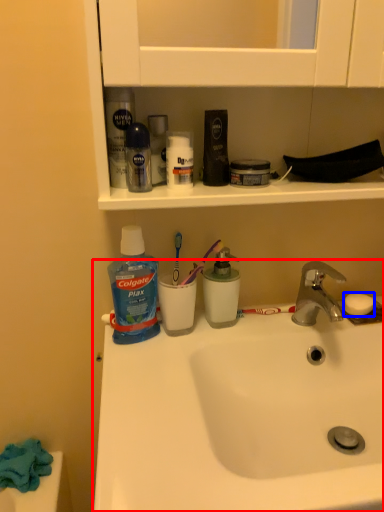
Question: Which object is closer to the camera taking this photo, sink (highlighted by a red box) or soap (highlighted by a blue box)?

Choices:
 (A) sink
 (B) soap

Answer: (A)